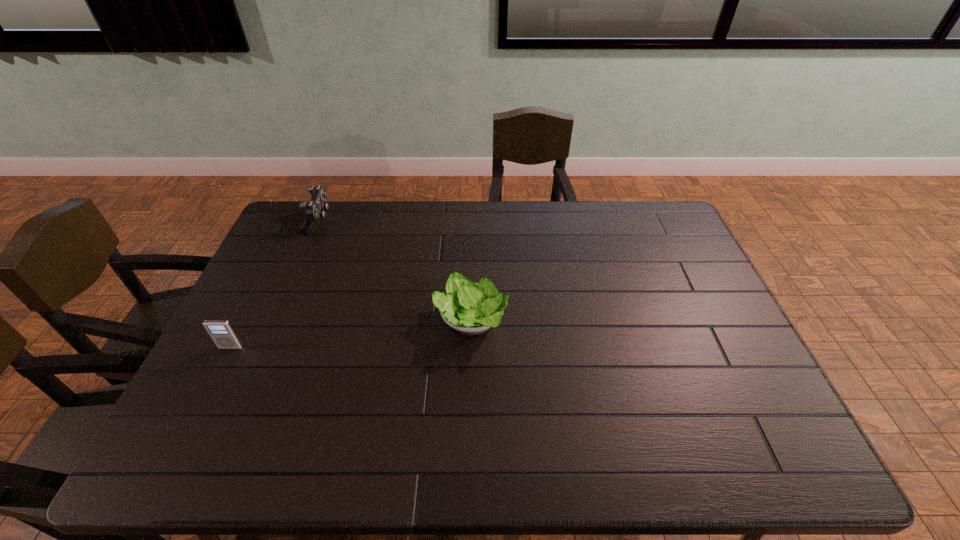
Identify the location of control. This screenshot has height=540, width=960. (314, 210).

The height and width of the screenshot is (540, 960). I want to click on the second object from right to left, so click(x=314, y=210).

Identify the location of lettuce. (471, 308).

At what (x,y) coordinates should I click in order to perform the action: click on iPod. Please return your answer as a coordinate pair (x, y). Looking at the image, I should click on (221, 331).

I want to click on vacant space located 0.390m on the surface of the control with buttons, so click(436, 220).

You are a GUI agent. You are given a task and a screenshot of the screen. Output one action in this format:
    pyautogui.click(x=<x>, y=<y>)
    Task: Click on the free space located 0.160m on the right of the lettuce
    This screenshot has width=960, height=540.
    Given the screenshot: What is the action you would take?
    pyautogui.click(x=564, y=321)

I want to click on vacant space located on the front-facing side of the leftmost object, so point(200,410).

Where is `object that is at the far edge`? object that is at the far edge is located at coordinates (314, 210).

Where is `control that is at the left edge`? control that is at the left edge is located at coordinates (314, 210).

Identify the location of iPod present at the left edge. (221, 331).